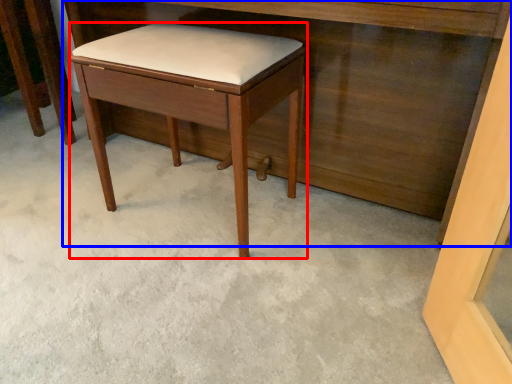
Question: Among these objects, which one is nearest to the camera, stool (highlighted by a red box) or vanity (highlighted by a blue box)?

Choices:
 (A) stool
 (B) vanity

Answer: (B)